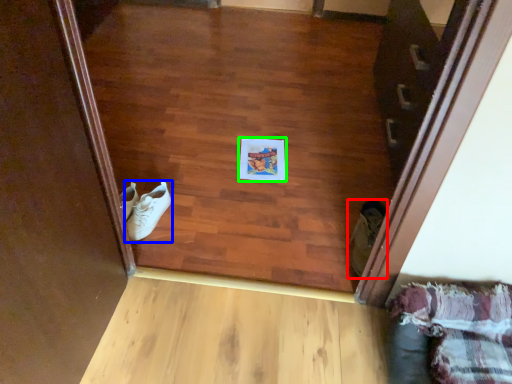
Question: Which object is positioned closest to footwear (highlighted by a red box)? Select from footwear (highlighted by a blue box) and copy (highlighted by a green box).

Choices:
 (A) footwear
 (B) copy

Answer: (B)